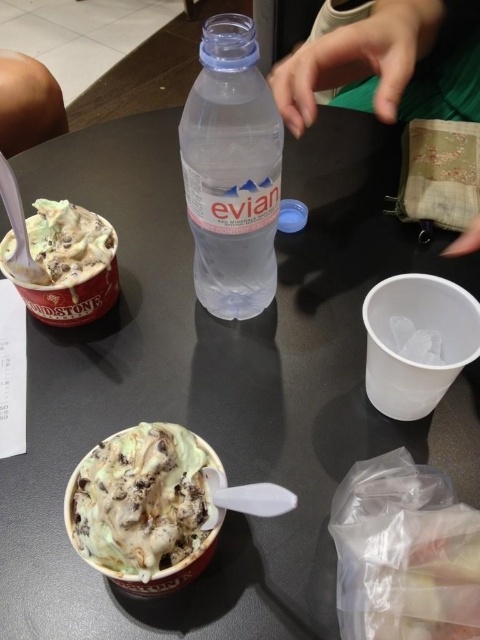
Question: Does transparent plastic bottle at center have a larger size compared to green ice cream with chocolate chips at center?

Choices:
 (A) yes
 (B) no

Answer: (A)

Question: Based on their relative distances, which object is farther from the green mint chocolate chip ice cream at left?

Choices:
 (A) green fabric pouch at upper right
 (B) transparent plastic bottle at center

Answer: (A)

Question: Which of the following is the closest to the observer?

Choices:
 (A) green fabric pouch at upper right
 (B) transparent plastic bottle at center

Answer: (B)

Question: Is transparent plastic bottle at center further to camera compared to green ice cream with chocolate chips at center?

Choices:
 (A) yes
 (B) no

Answer: (A)

Question: Is transparent plastic bottle at center further to camera compared to green fabric pouch at upper right?

Choices:
 (A) no
 (B) yes

Answer: (A)

Question: Which point is farther from the camera taking this photo?

Choices:
 (A) (376, 58)
 (B) (74, 269)

Answer: (B)